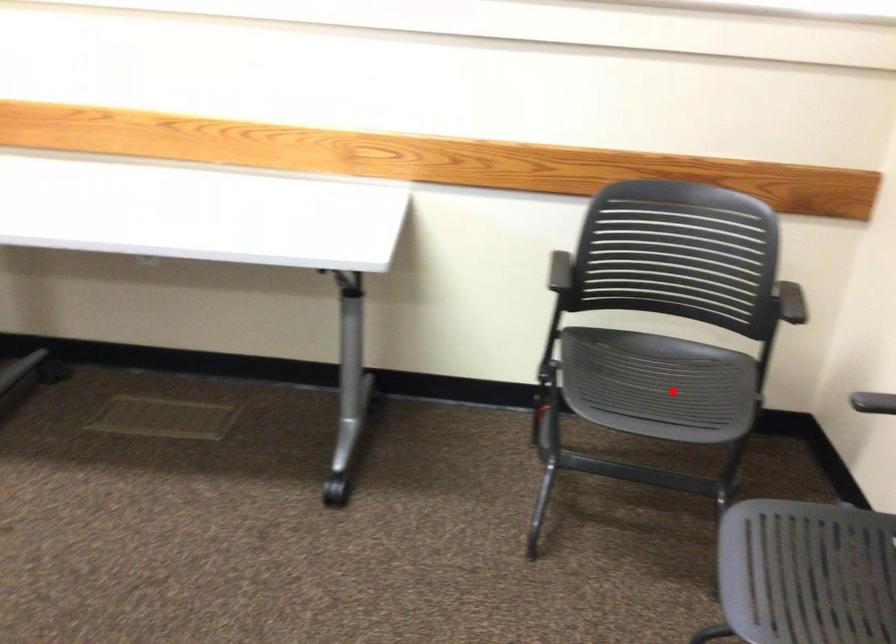
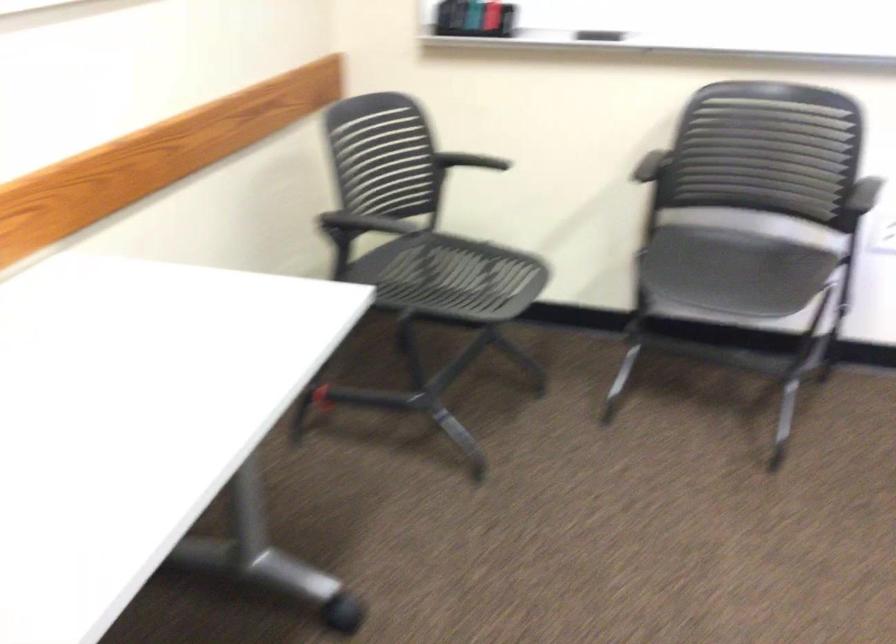
Locate, in the second image, the point that corresponds to the highlighted location in the first image.

(451, 277)